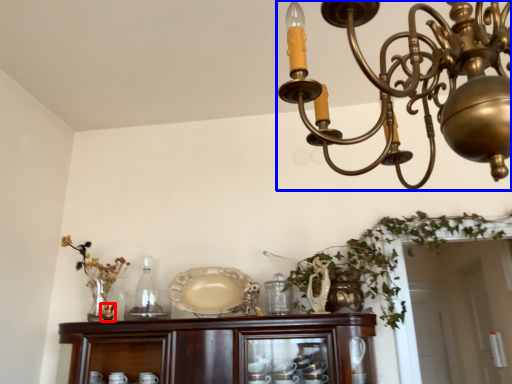
Question: Which point is further to the camera, candle holder (highlighted by a red box) or lamp (highlighted by a blue box)?

Choices:
 (A) candle holder
 (B) lamp

Answer: (A)